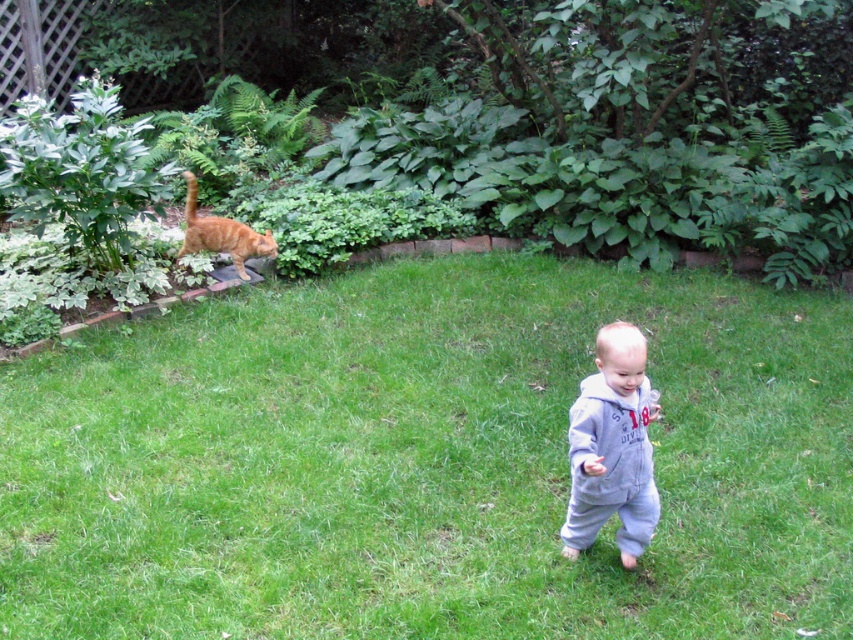
Who is shorter, gray fleece onesie at center or orange fur cat at upper left?

Standing shorter between the two is orange fur cat at upper left.

The height and width of the screenshot is (640, 853). Find the location of `gray fleece onesie at center`. gray fleece onesie at center is located at coordinates (612, 448).

What do you see at coordinates (612, 448) in the screenshot?
I see `gray fleece onesie at center` at bounding box center [612, 448].

The width and height of the screenshot is (853, 640). Identify the location of gray fleece onesie at center. (612, 448).

Who is taller, green grass at upper left or gray fleece onesie at center?

With more height is green grass at upper left.

Does green grass at upper left have a smaller size compared to gray fleece onesie at center?

No, green grass at upper left is not smaller than gray fleece onesie at center.

Between point (248, 432) and point (598, 468), which one is positioned behind?

The point (248, 432) is more distant.

The width and height of the screenshot is (853, 640). I want to click on green grass at upper left, so click(427, 461).

Is green grass at upper left further to the viewer compared to orange fur cat at upper left?

No, green grass at upper left is closer to the viewer.

Who is more forward, (x=790, y=508) or (x=209, y=225)?

Point (x=790, y=508) is more forward.

Describe the element at coordinates (427, 461) in the screenshot. I see `green grass at upper left` at that location.

You are a GUI agent. You are given a task and a screenshot of the screen. Output one action in this format:
    pyautogui.click(x=<x>, y=<y>)
    Task: Click on the green grass at upper left
    The width and height of the screenshot is (853, 640).
    Given the screenshot: What is the action you would take?
    pyautogui.click(x=427, y=461)